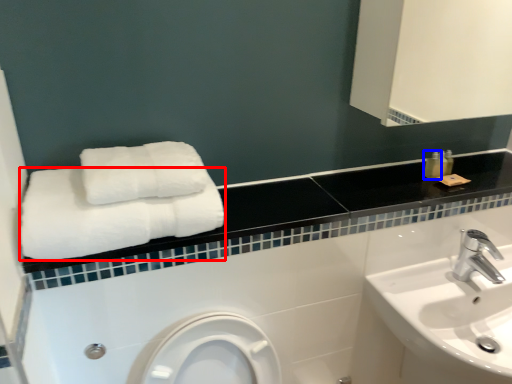
Question: Which point is closer to the camera, towel (highlighted by a red box) or toiletry (highlighted by a blue box)?

Choices:
 (A) towel
 (B) toiletry

Answer: (A)